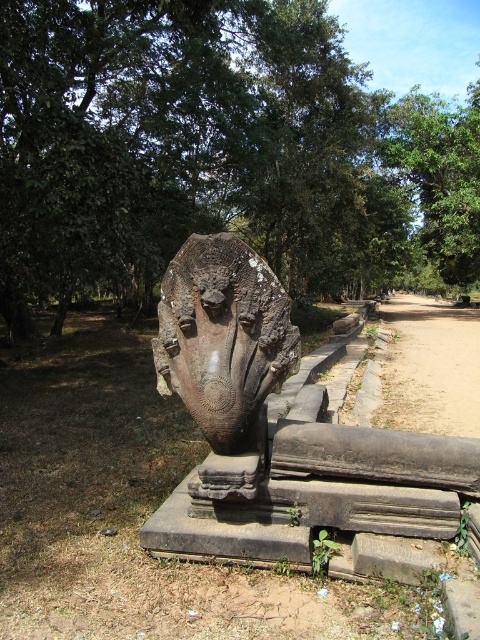
You are standing on the dirt path in front of the ancient stone sculpture. There are two points marked on the sculpture base. One is at coordinates point (26, 40) and the other is at point (271, 342). Which point is closer to you?

Point (271, 342) is closer to you because it is less further to the camera than point (26, 40).

You are standing at the entrance of the park and want to reach the rusty stone statue at center. Based on its coordinates, in which direction should you walk from your current position?

The rusty stone statue at center is located at coordinates point (279, 428). Since you are at the entrance, you should walk towards the center of the park to reach it.

In the scene shown: You are standing on the dirt path and want to take a photo of both the green rough stone tree at upper center and the rusty stone face at center. Which object should you focus on first to ensure both are in the frame?

You should focus on the rusty stone face at center first because the green rough stone tree at upper center is further away from you, so adjusting the focus starting from the closer object ensures both are in the frame.